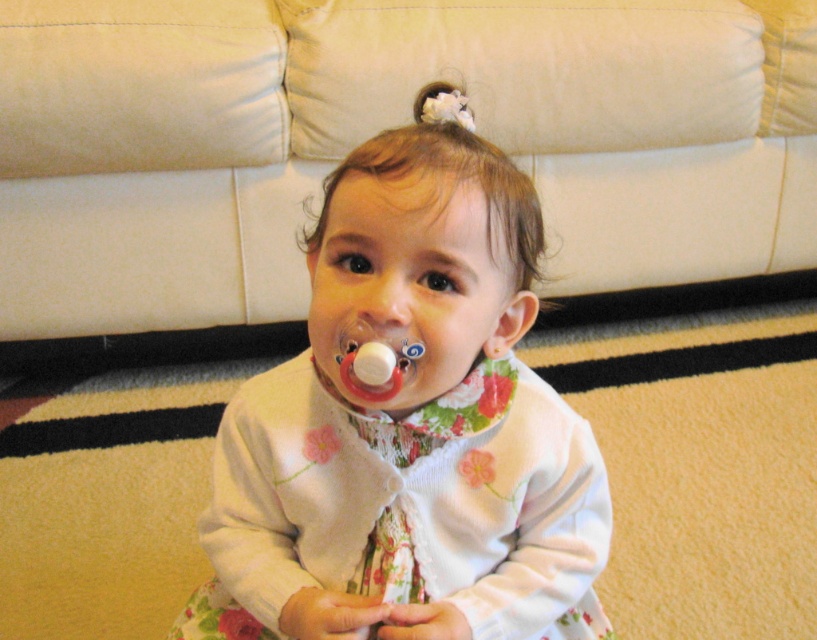
Question: Among these objects, which one is farthest from the camera?

Choices:
 (A) rubber pacifier at center
 (B) white leather couch at upper center

Answer: (B)

Question: Does white leather couch at upper center lie in front of white floral dress at center?

Choices:
 (A) no
 (B) yes

Answer: (A)

Question: Among these points, which one is nearest to the camera?

Choices:
 (A) (400, 296)
 (B) (536, 19)
 (C) (414, 381)

Answer: (A)

Question: Does white leather couch at upper center lie in front of rubber pacifier at center?

Choices:
 (A) yes
 (B) no

Answer: (B)

Question: Is white leather couch at upper center below smooth white pacifier at center?

Choices:
 (A) no
 (B) yes

Answer: (A)

Question: Which point appears closest to the camera in this image?

Choices:
 (A) (338, 371)
 (B) (224, 604)

Answer: (A)